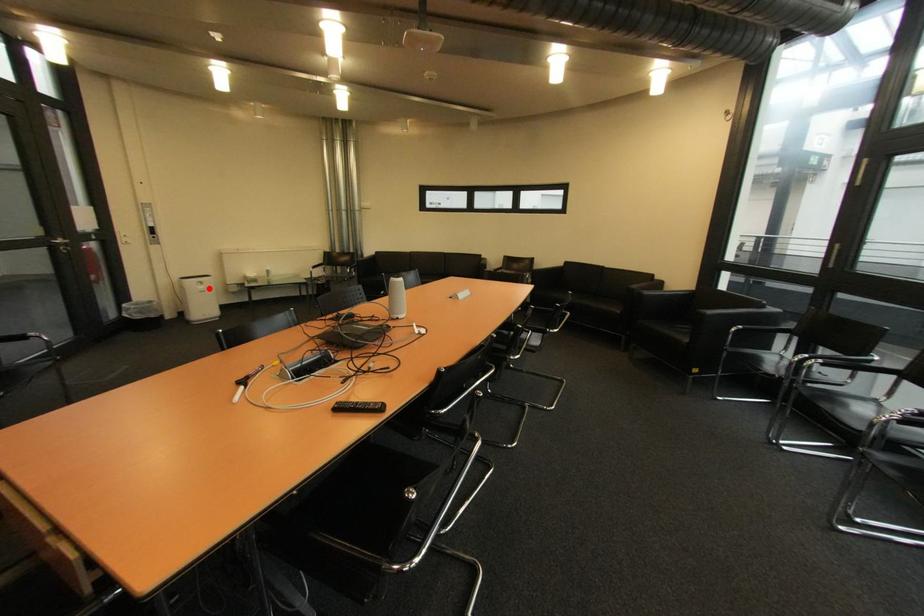
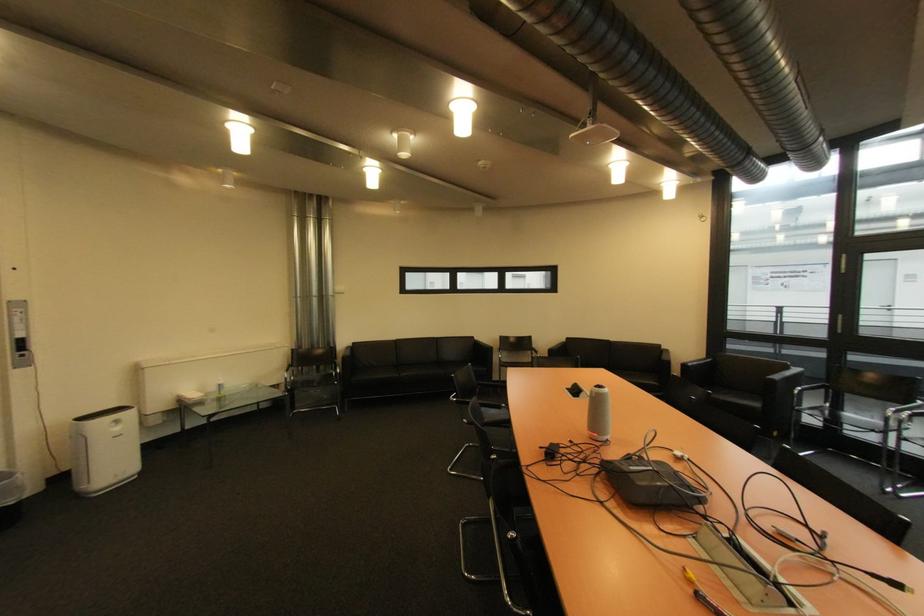
Question: I am providing you with two images of the same scene from different viewpoints. A red point is shown in image1. For the corresponding object point in image2, is it positioned nearer or farther from the camera?

Choices:
 (A) Nearer
 (B) Farther

Answer: (B)